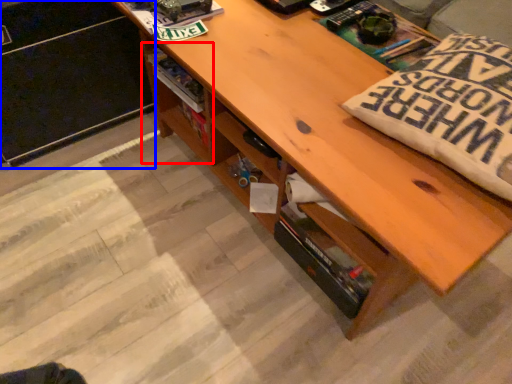
Question: Which object is further to the camera taking this photo, shelf (highlighted by a red box) or file cabinet (highlighted by a blue box)?

Choices:
 (A) shelf
 (B) file cabinet

Answer: (A)